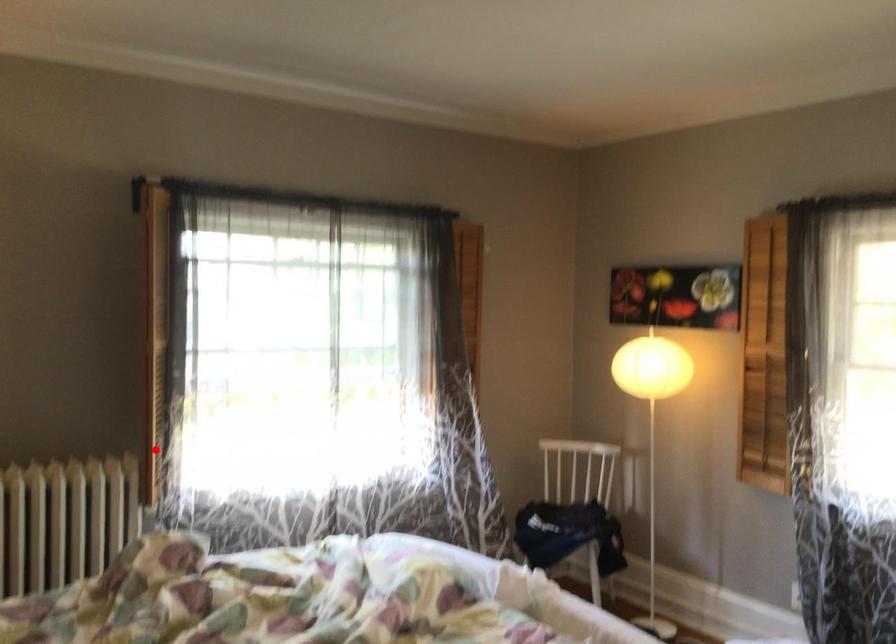
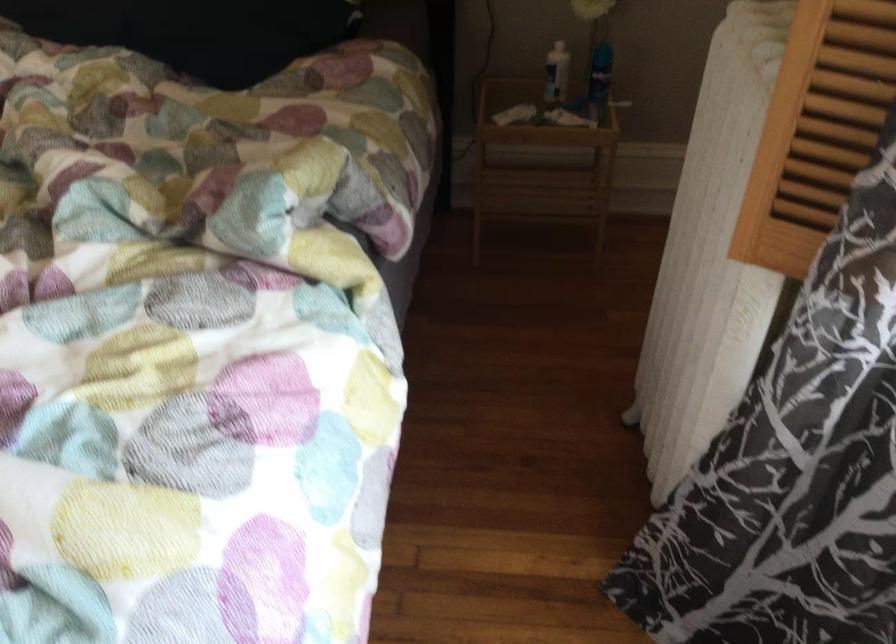
Question: I am providing you with two images of the same scene from different viewpoints. Image1 has a red point marked. In image2, the corresponding 3D location appears at what relative position? Reply with the corresponding letter.

Choices:
 (A) Closer
 (B) Farther

Answer: (A)